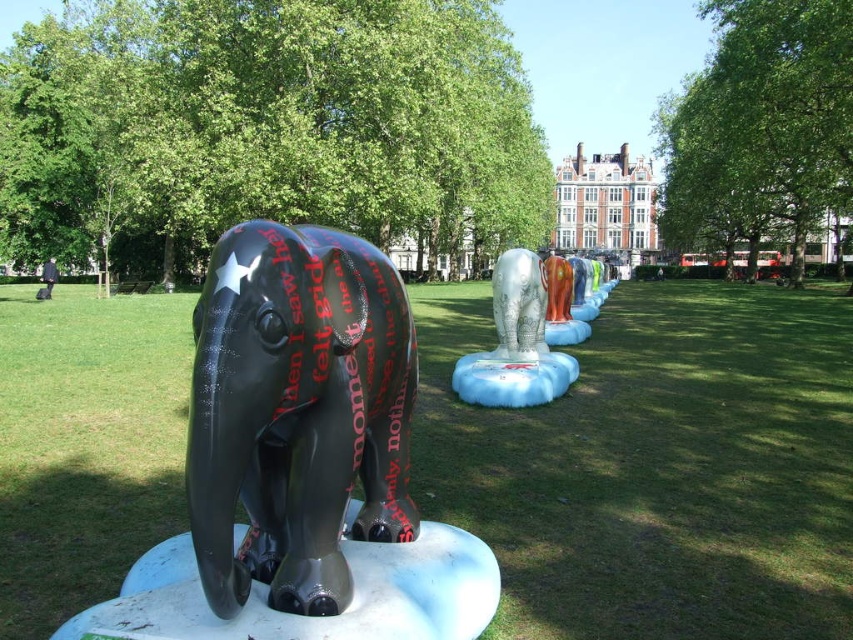
Question: Estimate the real-world distances between objects in this image. Which object is closer to the shiny silver elephant at center?

Choices:
 (A) glossy black elephant at center
 (B) white glossy elephant at center

Answer: (B)

Question: From the image, what is the correct spatial relationship of white glossy elephant at center in relation to shiny silver elephant at center?

Choices:
 (A) left
 (B) right

Answer: (B)

Question: Can you confirm if glossy black elephant at center is smaller than white glossy elephant at center?

Choices:
 (A) yes
 (B) no

Answer: (B)

Question: Which is farther from the white glossy elephant at center?

Choices:
 (A) shiny silver elephant at center
 (B) glossy black elephant at center

Answer: (B)

Question: In this image, where is glossy black elephant at center located relative to white glossy elephant at center?

Choices:
 (A) below
 (B) above

Answer: (A)

Question: Which object is the closest to the shiny silver elephant at center?

Choices:
 (A) white glossy elephant at center
 (B) glossy black elephant at center

Answer: (A)